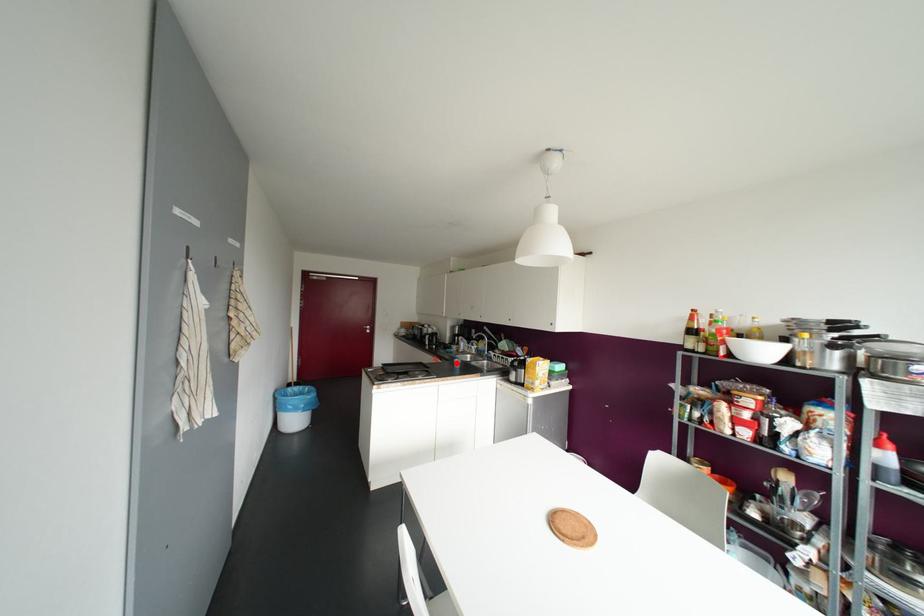
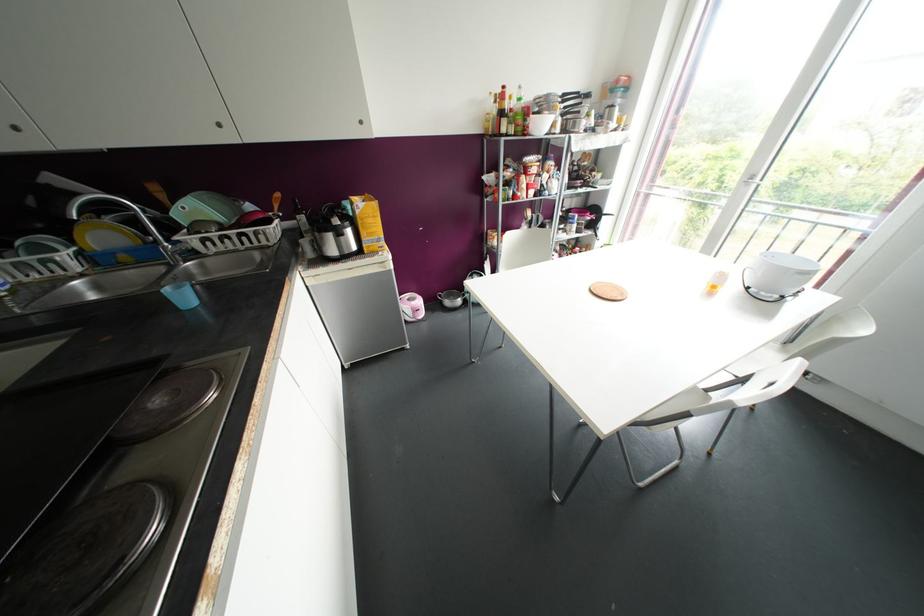
Locate, in the second image, the point that corresponds to the highlighted location in the first image.

(184, 297)